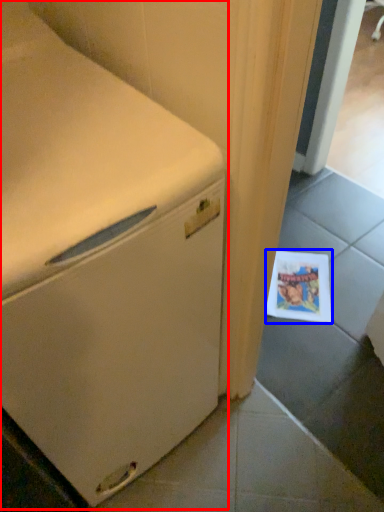
Question: Which point is further to the camera, home appliance (highlighted by a red box) or postcard (highlighted by a blue box)?

Choices:
 (A) home appliance
 (B) postcard

Answer: (B)